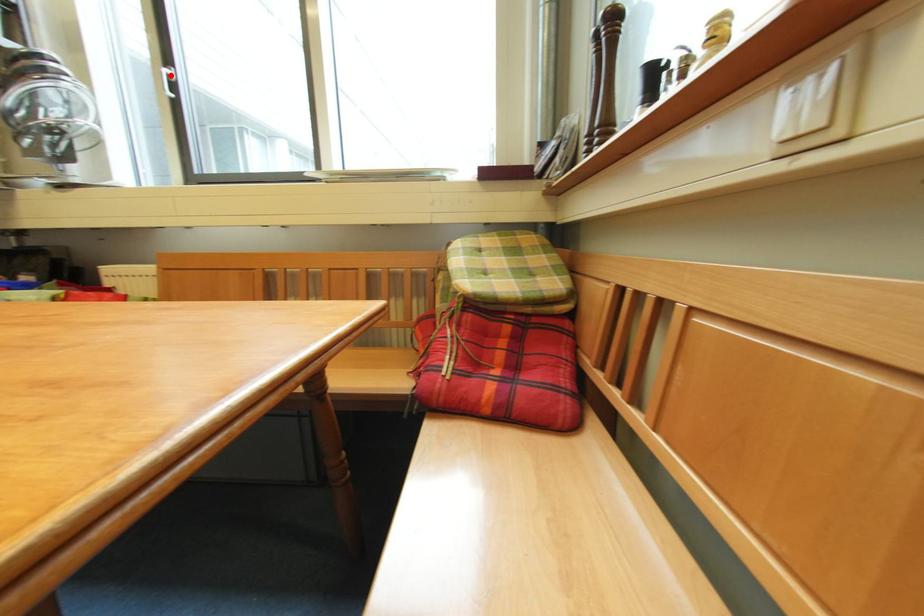
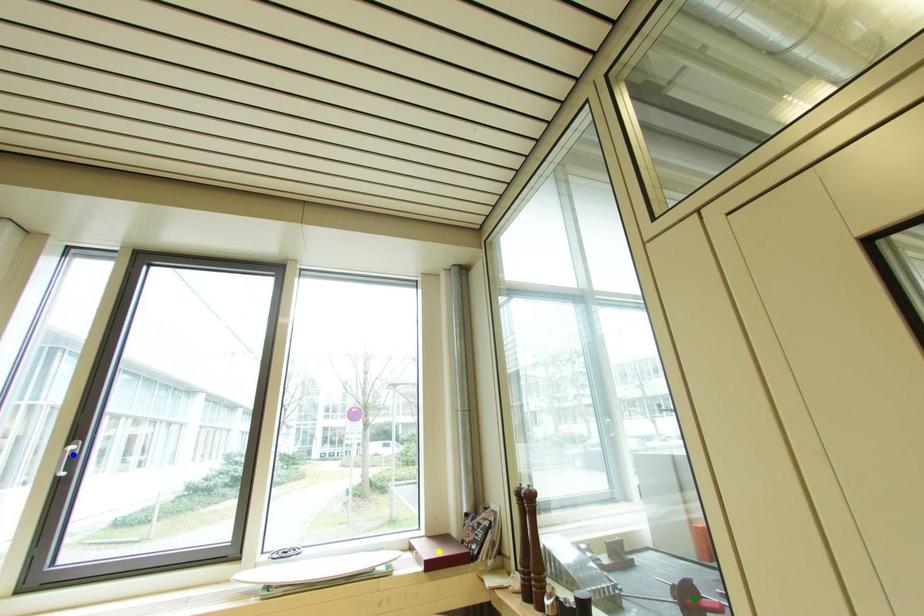
Question: I am providing you with two images of the same scene from different viewpoints. A red point is marked on the first image. You are given multiple points on the second image. Which point in image 2 represents the same 3d spot as the red point in image 1?

Choices:
 (A) green point
 (B) yellow point
 (C) blue point

Answer: (C)